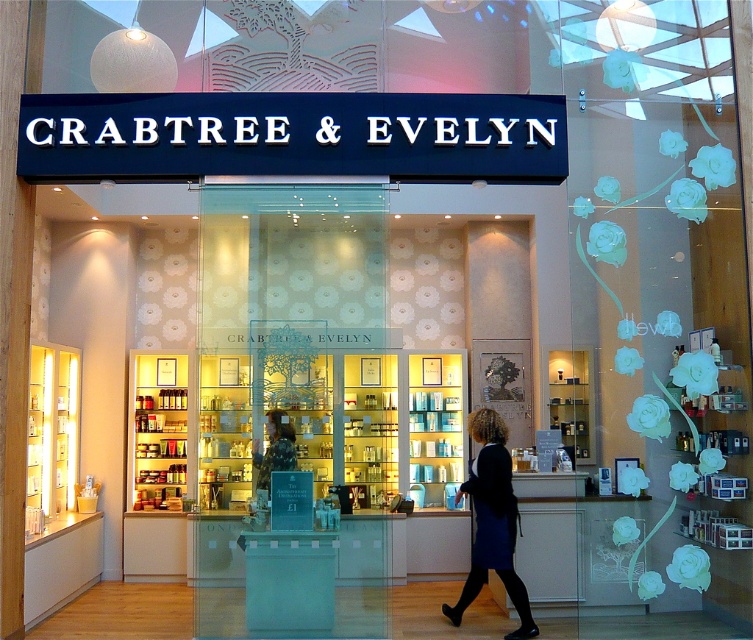
You are a customer browsing the Crabtree and Evelyn store and see both the dark blue dress at center and the matte black statue at center. Which item takes up more space in the store?

The dark blue dress at center is bigger than the matte black statue at center, so it takes up more space in the store.

You are a customer browsing the Crabtree and Evelyn store and see the dark blue dress at center and the matte black statue at center. Which one do you think is taller?

The dark blue dress at center is much taller than the matte black statue at center.

You are a customer standing at the entrance of the Crabtree and Evelyn store. You see a dark blue dress at center and a matte black statue at center. If you want to pick up both items, which one should you go to first to minimize the distance you walk?

Both the dark blue dress at center and the matte black statue at center are located at the center of the store, so the distance to reach either is the same. You can choose either one first without walking extra distance.